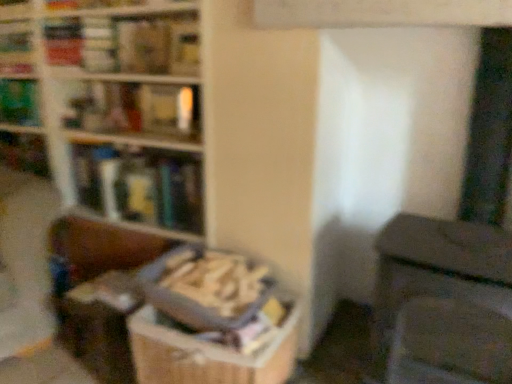
Image resolution: width=512 pixels, height=384 pixels. What do you see at coordinates (19, 102) in the screenshot?
I see `green matte book at upper left, which is counted as the second book, starting from the top` at bounding box center [19, 102].

I want to click on hardcover book at left, placed as the fourth book when sorted from top to bottom, so click(x=140, y=185).

What do you see at coordinates (136, 109) in the screenshot? This screenshot has height=384, width=512. I see `hardcover book at upper left, placed as the third book when sorted from bottom to top` at bounding box center [136, 109].

Describe the element at coordinates (114, 105) in the screenshot. The width and height of the screenshot is (512, 384). I see `wooden bookcase at upper left` at that location.

Identify the location of wooden bookcase at upper left. This screenshot has height=384, width=512. (114, 105).

This screenshot has width=512, height=384. Identify the location of hardcover book at upper center, the first book viewed from the top. (143, 47).

Does point (172, 211) appear closer or farther from the camera than point (169, 134)?

Point (172, 211).

The width and height of the screenshot is (512, 384). Identify the location of the 1st book in front of the hardcover book at upper left, which is counted as the third book, starting from the top, counting from the anchor's position. (140, 185).

Is hardcover book at left, placed as the second book when sorted from bottom to top, not within hardcover book at upper left, which is counted as the third book, starting from the top?

That's correct, hardcover book at left, placed as the second book when sorted from bottom to top, is outside of hardcover book at upper left, which is counted as the third book, starting from the top.

Does hardcover book at left, placed as the fourth book when sorted from top to bottom, turn towards hardcover book at upper left, which is counted as the third book, starting from the top?

No, hardcover book at left, placed as the fourth book when sorted from top to bottom, does not turn towards hardcover book at upper left, which is counted as the third book, starting from the top.

From the image's perspective, is hardcover book at upper left, which is counted as the third book, starting from the top, positioned above or below hardcover book at upper center, arranged as the 5th book when ordered from the bottom?

From the image's perspective, hardcover book at upper left, which is counted as the third book, starting from the top, appears below hardcover book at upper center, arranged as the 5th book when ordered from the bottom.

Considering the sizes of hardcover book at upper left, placed as the third book when sorted from bottom to top, and hardcover book at upper center, arranged as the 5th book when ordered from the bottom, in the image, is hardcover book at upper left, placed as the third book when sorted from bottom to top, wider or thinner than hardcover book at upper center, arranged as the 5th book when ordered from the bottom,?

hardcover book at upper left, placed as the third book when sorted from bottom to top, is wider than hardcover book at upper center, arranged as the 5th book when ordered from the bottom.

Considering the sizes of objects hardcover book at upper left, placed as the third book when sorted from bottom to top, and hardcover book at upper center, the first book viewed from the top, in the image provided, who is shorter, hardcover book at upper left, placed as the third book when sorted from bottom to top, or hardcover book at upper center, the first book viewed from the top,?

With less height is hardcover book at upper center, the first book viewed from the top.

Considering the relative sizes of hardcover book at upper left, placed as the third book when sorted from bottom to top, and hardcover book at upper center, arranged as the 5th book when ordered from the bottom, in the image provided, is hardcover book at upper left, placed as the third book when sorted from bottom to top, bigger than hardcover book at upper center, arranged as the 5th book when ordered from the bottom,?

Yes, hardcover book at upper left, placed as the third book when sorted from bottom to top, is bigger than hardcover book at upper center, arranged as the 5th book when ordered from the bottom.

Locate an element on the screen. The width and height of the screenshot is (512, 384). the 1st book behind the hardcover book at left, placed as the fourth book when sorted from top to bottom is located at coordinates [136, 109].

Which object is wider, hardcover book at upper left, which is counted as the third book, starting from the top, or hardcover book at left, placed as the second book when sorted from bottom to top?

With larger width is hardcover book at left, placed as the second book when sorted from bottom to top.

Who is smaller, hardcover book at upper left, which is counted as the third book, starting from the top, or hardcover book at left, placed as the fourth book when sorted from top to bottom?

With smaller size is hardcover book at upper left, which is counted as the third book, starting from the top.

Is hardcover book at upper left, which is counted as the third book, starting from the top, beside hardcover book at left, placed as the second book when sorted from bottom to top?

No, hardcover book at upper left, which is counted as the third book, starting from the top, is not next to hardcover book at left, placed as the second book when sorted from bottom to top.

How far apart are wooden bookcase at upper left and green matte book at upper left, which is counted as the second book, starting from the top?

wooden bookcase at upper left and green matte book at upper left, which is counted as the second book, starting from the top, are 17.08 inches apart.

You are a GUI agent. You are given a task and a screenshot of the screen. Output one action in this format:
    pyautogui.click(x=<x>, y=<y>)
    Task: Click on the 1st book above the wooden bookcase at upper left (from a real-world perspective)
    
    Given the screenshot: What is the action you would take?
    pyautogui.click(x=19, y=102)

In the image, is wooden bookcase at upper left on the left side or the right side of green matte book at upper left, which is counted as the second book, starting from the top?

From the image, it's evident that wooden bookcase at upper left is to the right of green matte book at upper left, which is counted as the second book, starting from the top.

Which is closer to the camera, (113, 209) or (21, 121)?

The point (113, 209) is closer to the camera.

Which object is further away from the camera taking this photo, wooden bookcase at upper left or hardcover book at upper left, placed as the third book when sorted from bottom to top?

hardcover book at upper left, placed as the third book when sorted from bottom to top.

From the image's perspective, which is above, wooden bookcase at upper left or hardcover book at upper left, which is counted as the third book, starting from the top?

hardcover book at upper left, which is counted as the third book, starting from the top, appears higher in the image.

Is the surface of wooden bookcase at upper left in direct contact with hardcover book at upper left, placed as the third book when sorted from bottom to top?

No, wooden bookcase at upper left is not next to hardcover book at upper left, placed as the third book when sorted from bottom to top.

Does wooden bookcase at upper left have a greater width compared to hardcover book at upper left, placed as the third book when sorted from bottom to top?

Yes.

Which point is more forward, (147, 293) or (159, 185)?

The point (147, 293) is closer to the camera.

How different are the orientations of wooden textured book at center, which ranks as the 1th book in bottom-to-top order, and hardcover book at left, placed as the second book when sorted from bottom to top, in degrees?

The angle between the facing direction of wooden textured book at center, which ranks as the 1th book in bottom-to-top order, and the facing direction of hardcover book at left, placed as the second book when sorted from bottom to top, is 0.38 degrees.

Is wooden textured book at center, placed as the fifth book when sorted from top to bottom, far from hardcover book at left, placed as the fourth book when sorted from top to bottom?

That's not correct — wooden textured book at center, placed as the fifth book when sorted from top to bottom, is a little close to hardcover book at left, placed as the fourth book when sorted from top to bottom.

Does wooden textured book at center, placed as the fifth book when sorted from top to bottom, lie in front of hardcover book at left, placed as the fourth book when sorted from top to bottom?

Yes, wooden textured book at center, placed as the fifth book when sorted from top to bottom, is in front of hardcover book at left, placed as the fourth book when sorted from top to bottom.

Can you confirm if wooden textured book at center, placed as the fifth book when sorted from top to bottom, is positioned to the right of wooden bookcase at upper left?

Indeed, wooden textured book at center, placed as the fifth book when sorted from top to bottom, is positioned on the right side of wooden bookcase at upper left.

From the image's perspective, between wooden textured book at center, placed as the fifth book when sorted from top to bottom, and wooden bookcase at upper left, which one is located above?

From the image's view, wooden bookcase at upper left is above.

In the scene shown: Is wooden textured book at center, placed as the fifth book when sorted from top to bottom, positioned far away from wooden bookcase at upper left?

wooden textured book at center, placed as the fifth book when sorted from top to bottom, is actually quite close to wooden bookcase at upper left.

In the scene shown: Could you tell me if wooden textured book at center, placed as the fifth book when sorted from top to bottom, is facing wooden bookcase at upper left?

No, wooden textured book at center, placed as the fifth book when sorted from top to bottom, does not turn towards wooden bookcase at upper left.

From a real-world perspective, which book is the 2nd one underneath the hardcover book at upper left, which is counted as the third book, starting from the top? Please provide its 2D coordinates.

[(140, 185)]

Image resolution: width=512 pixels, height=384 pixels. I want to click on the 2nd book to the left of the hardcover book at upper center, arranged as the 5th book when ordered from the bottom, counting from the anchor's position, so click(136, 109).

From the image, which object appears to be farther from wooden bookcase at upper left, hardcover book at upper center, the first book viewed from the top, or hardcover book at upper left, which is counted as the third book, starting from the top?

hardcover book at upper center, the first book viewed from the top.

Looking at the image, which one is located closer to hardcover book at upper center, arranged as the 5th book when ordered from the bottom, wooden bookcase at upper left or hardcover book at upper left, which is counted as the third book, starting from the top?

hardcover book at upper left, which is counted as the third book, starting from the top, is positioned closer to the anchor hardcover book at upper center, arranged as the 5th book when ordered from the bottom.

Based on their spatial positions, is hardcover book at upper center, arranged as the 5th book when ordered from the bottom, or hardcover book at left, placed as the second book when sorted from bottom to top, closer to green matte book at upper left, the fourth book from the bottom?

hardcover book at left, placed as the second book when sorted from bottom to top, is closer to green matte book at upper left, the fourth book from the bottom.

Which object lies nearer to the anchor point hardcover book at upper center, the first book viewed from the top, hardcover book at upper left, which is counted as the third book, starting from the top, or green matte book at upper left, which is counted as the second book, starting from the top?

Based on the image, hardcover book at upper left, which is counted as the third book, starting from the top, appears to be nearer to hardcover book at upper center, the first book viewed from the top.

In the scene shown: From the image, which object appears to be nearer to hardcover book at upper left, placed as the third book when sorted from bottom to top, hardcover book at left, placed as the second book when sorted from bottom to top, or wooden textured book at center, placed as the fifth book when sorted from top to bottom?

hardcover book at left, placed as the second book when sorted from bottom to top, is positioned closer to the anchor hardcover book at upper left, placed as the third book when sorted from bottom to top.

Consider the image. When comparing their distances from green matte book at upper left, the fourth book from the bottom, does hardcover book at upper left, which is counted as the third book, starting from the top, or wooden textured book at center, placed as the fifth book when sorted from top to bottom, seem closer?

hardcover book at upper left, which is counted as the third book, starting from the top, is positioned closer to the anchor green matte book at upper left, the fourth book from the bottom.

From the picture: Estimate the real-world distances between objects in this image. Which object is closer to wooden textured book at center, placed as the fifth book when sorted from top to bottom, wooden bookcase at upper left or hardcover book at upper center, arranged as the 5th book when ordered from the bottom?

Among the two, wooden bookcase at upper left is located nearer to wooden textured book at center, placed as the fifth book when sorted from top to bottom.

From the image, which object appears to be farther from wooden textured book at center, placed as the fifth book when sorted from top to bottom, hardcover book at upper left, placed as the third book when sorted from bottom to top, or hardcover book at upper center, the first book viewed from the top?

Based on the image, hardcover book at upper center, the first book viewed from the top, appears to be further to wooden textured book at center, placed as the fifth book when sorted from top to bottom.

The width and height of the screenshot is (512, 384). I want to click on book between hardcover book at upper left, placed as the third book when sorted from bottom to top, and wooden textured book at center, which ranks as the 1th book in bottom-to-top order, vertically, so click(140, 185).

Identify the location of bookcase that lies between hardcover book at upper center, the first book viewed from the top, and wooden textured book at center, placed as the fifth book when sorted from top to bottom, from top to bottom. click(x=114, y=105).

Image resolution: width=512 pixels, height=384 pixels. What are the coordinates of `book between green matte book at upper left, which is counted as the second book, starting from the top, and hardcover book at left, placed as the fourth book when sorted from top to bottom, in the horizontal direction` in the screenshot? It's located at (136, 109).

Where is `bookcase between green matte book at upper left, which is counted as the second book, starting from the top, and hardcover book at left, placed as the second book when sorted from bottom to top`? bookcase between green matte book at upper left, which is counted as the second book, starting from the top, and hardcover book at left, placed as the second book when sorted from bottom to top is located at coordinates (114, 105).